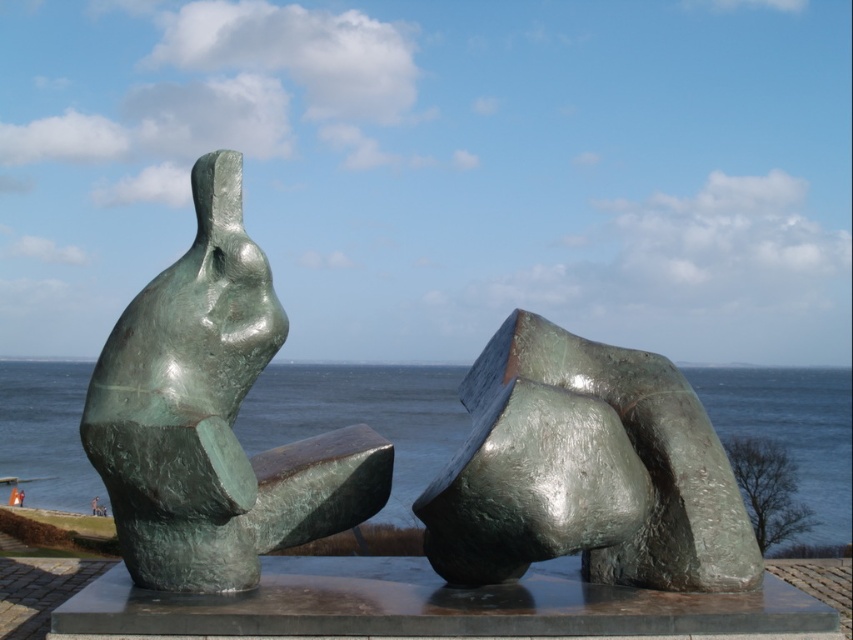
You are an art curator planning to move the green polished bronze statue at left closer to the green metallic water at center. Given their sizes, will the statue fit in the space currently occupied by the water?

The green polished bronze statue at left is smaller than the green metallic water at center, so it should fit in the space currently occupied by the green metallic water at center.

You are an art critic observing the two sculptures in the image. Which of the two objects, the green polished stone abstract form at center or the green metallic water at center, is positioned higher in the scene?

The green polished stone abstract form at center is positioned higher than the green metallic water at center.

You are an artist planning to install a new sculpture in the park. You want to place a third sculpture that is wider than the green polished stone abstract form at center but narrower than the green metallic water at center. Is this possible based on the current arrangement?

Yes, it is possible to place a third sculpture wider than the green polished stone abstract form at center but narrower than the green metallic water at center, since the green polished stone abstract form at center has a lesser width compared to green metallic water at center.